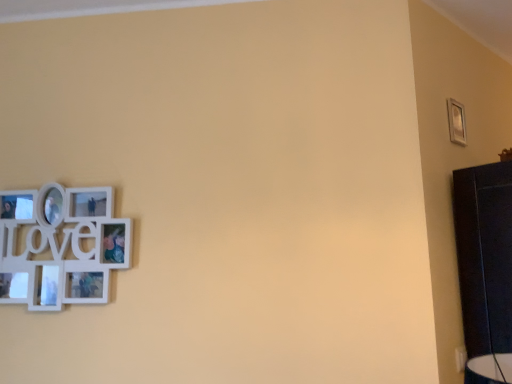
Question: Is point (449, 99) closer or farther from the camera than point (8, 203)?

Choices:
 (A) closer
 (B) farther

Answer: (B)

Question: From a real-world perspective, relative to white matte picture frame at left, the second picture frame from the top, is silver metallic picture frame at upper right, the second picture frame when ordered from bottom to top, vertically above or below?

Choices:
 (A) above
 (B) below

Answer: (A)

Question: In the image, is silver metallic picture frame at upper right, the 1th picture frame in the back-to-front sequence, positioned in front of or behind white matte picture frame at left, arranged as the second picture frame when viewed from the back?

Choices:
 (A) behind
 (B) front

Answer: (A)

Question: From the image's perspective, relative to silver metallic picture frame at upper right, the 1th picture frame viewed from the top, is white matte picture frame at left, arranged as the 1th picture frame when viewed from the front, above or below?

Choices:
 (A) below
 (B) above

Answer: (A)

Question: Is white matte picture frame at left, arranged as the second picture frame when viewed from the back, in front of or behind silver metallic picture frame at upper right, the 1th picture frame viewed from the top, in the image?

Choices:
 (A) behind
 (B) front

Answer: (B)

Question: Considering the relative positions of white matte picture frame at left, the second picture frame from the top, and silver metallic picture frame at upper right, the second picture frame when ordered from bottom to top, in the image provided, is white matte picture frame at left, the second picture frame from the top, to the left or to the right of silver metallic picture frame at upper right, the second picture frame when ordered from bottom to top,?

Choices:
 (A) right
 (B) left

Answer: (B)

Question: Based on their sizes in the image, would you say white matte picture frame at left, marked as the second picture frame in a right-to-left arrangement, is bigger or smaller than silver metallic picture frame at upper right, the 1th picture frame viewed from the top?

Choices:
 (A) big
 (B) small

Answer: (A)